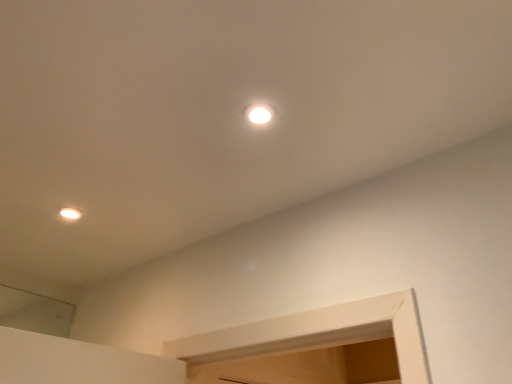
Image resolution: width=512 pixels, height=384 pixels. Find the location of `matte white droplight at upper center`. matte white droplight at upper center is located at coordinates (259, 114).

The height and width of the screenshot is (384, 512). What do you see at coordinates (259, 114) in the screenshot?
I see `matte white droplight at upper center` at bounding box center [259, 114].

Find the location of `matte white droplight at upper center`. matte white droplight at upper center is located at coordinates (259, 114).